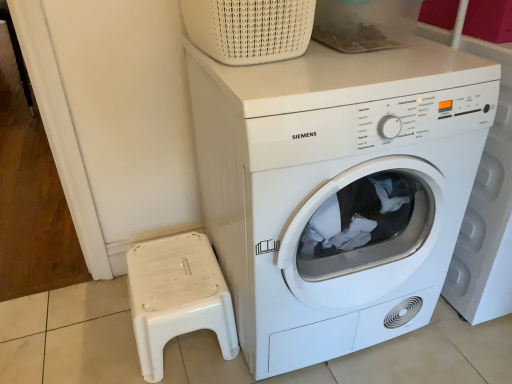
Question: Does white woven basket at upper center have a lesser height compared to white matte washing machine at center?

Choices:
 (A) yes
 (B) no

Answer: (A)

Question: Can you confirm if white woven basket at upper center is bigger than white matte washing machine at center?

Choices:
 (A) yes
 (B) no

Answer: (B)

Question: Does white woven basket at upper center appear on the left side of white matte washing machine at center?

Choices:
 (A) no
 (B) yes

Answer: (B)

Question: Is white woven basket at upper center completely or partially outside of white matte washing machine at center?

Choices:
 (A) yes
 (B) no

Answer: (A)

Question: Is white woven basket at upper center thinner than white matte washing machine at center?

Choices:
 (A) yes
 (B) no

Answer: (A)

Question: Considering the relative positions of white woven basket at upper center and white matte washing machine at center in the image provided, is white woven basket at upper center behind white matte washing machine at center?

Choices:
 (A) no
 (B) yes

Answer: (B)

Question: From the image's perspective, is white plastic stool at lower left beneath white woven basket at upper center?

Choices:
 (A) no
 (B) yes

Answer: (B)

Question: Does white plastic stool at lower left have a smaller size compared to white woven basket at upper center?

Choices:
 (A) yes
 (B) no

Answer: (B)

Question: Is white plastic stool at lower left positioned before white woven basket at upper center?

Choices:
 (A) yes
 (B) no

Answer: (B)

Question: Is white woven basket at upper center at the back of white plastic stool at lower left?

Choices:
 (A) no
 (B) yes

Answer: (A)

Question: From the image's perspective, is white plastic stool at lower left over white woven basket at upper center?

Choices:
 (A) yes
 (B) no

Answer: (B)

Question: Is white plastic stool at lower left placed right next to white woven basket at upper center?

Choices:
 (A) no
 (B) yes

Answer: (A)

Question: Is white woven basket at upper center turned away from white plastic stool at lower left?

Choices:
 (A) no
 (B) yes

Answer: (A)